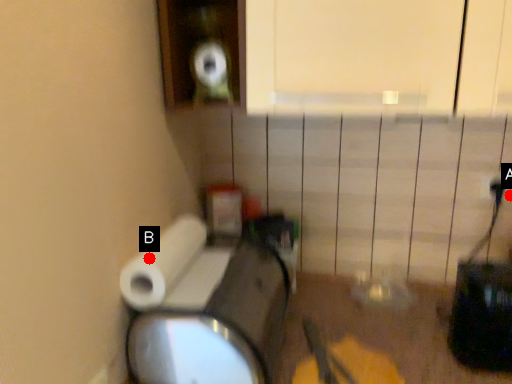
Question: Two points are circled on the image, labeled by A and B beside each circle. Which point is farther from the camera taking this photo?

Choices:
 (A) A is further
 (B) B is further

Answer: (A)